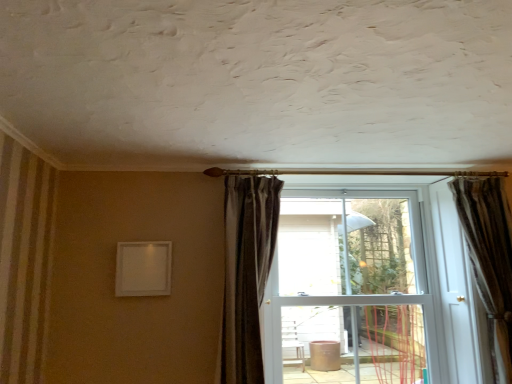
Question: Should I look upward or downward to see dark brown velvet curtain at center, the second curtain when ordered from right to left?

Choices:
 (A) down
 (B) up

Answer: (A)

Question: Considering the relative positions of white glossy door at center and dark brown velvet curtain at center, the second curtain when ordered from right to left, in the image provided, is white glossy door at center to the left of dark brown velvet curtain at center, the second curtain when ordered from right to left, from the viewer's perspective?

Choices:
 (A) yes
 (B) no

Answer: (B)

Question: From the image's perspective, is white glossy door at center above dark brown velvet curtain at center, the second curtain when ordered from right to left?

Choices:
 (A) yes
 (B) no

Answer: (B)

Question: Is white glossy door at center thinner than dark brown velvet curtain at center, arranged as the first curtain when viewed from the left?

Choices:
 (A) no
 (B) yes

Answer: (A)

Question: From a real-world perspective, is white glossy door at center positioned under dark brown velvet curtain at center, arranged as the first curtain when viewed from the left, based on gravity?

Choices:
 (A) yes
 (B) no

Answer: (A)

Question: Considering the relative sizes of white glossy door at center and dark brown velvet curtain at center, arranged as the first curtain when viewed from the left, in the image provided, is white glossy door at center taller than dark brown velvet curtain at center, arranged as the first curtain when viewed from the left,?

Choices:
 (A) no
 (B) yes

Answer: (B)

Question: Does white glossy door at center appear on the right side of dark brown velvet curtain at center, the second curtain when ordered from right to left?

Choices:
 (A) yes
 (B) no

Answer: (A)

Question: From the image's perspective, is brown textured curtain at right, positioned as the 2th curtain in left-to-right order, above dark brown velvet curtain at center, the second curtain when ordered from right to left?

Choices:
 (A) no
 (B) yes

Answer: (A)

Question: Can you confirm if brown textured curtain at right, the 1th curtain viewed from the right, is smaller than dark brown velvet curtain at center, arranged as the first curtain when viewed from the left?

Choices:
 (A) no
 (B) yes

Answer: (B)

Question: Is brown textured curtain at right, the 1th curtain viewed from the right, with dark brown velvet curtain at center, arranged as the first curtain when viewed from the left?

Choices:
 (A) no
 (B) yes

Answer: (A)

Question: Is brown textured curtain at right, positioned as the 2th curtain in left-to-right order, to the right of dark brown velvet curtain at center, arranged as the first curtain when viewed from the left, from the viewer's perspective?

Choices:
 (A) yes
 (B) no

Answer: (A)

Question: Is brown textured curtain at right, positioned as the 2th curtain in left-to-right order, oriented away from dark brown velvet curtain at center, the second curtain when ordered from right to left?

Choices:
 (A) no
 (B) yes

Answer: (A)

Question: From a real-world perspective, does brown textured curtain at right, positioned as the 2th curtain in left-to-right order, stand above dark brown velvet curtain at center, the second curtain when ordered from right to left?

Choices:
 (A) no
 (B) yes

Answer: (A)

Question: Does white glossy door at center come in front of brown textured curtain at right, the 1th curtain viewed from the right?

Choices:
 (A) no
 (B) yes

Answer: (A)